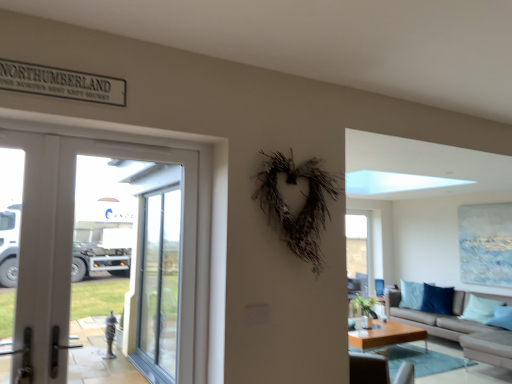
Question: Considering the relative sizes of clear glass screen door at center, which appears as the 2th screen door when viewed from the front, and light brown wooden coffee table at lower center in the image provided, is clear glass screen door at center, which appears as the 2th screen door when viewed from the front, wider than light brown wooden coffee table at lower center?

Choices:
 (A) yes
 (B) no

Answer: (B)

Question: Is clear glass screen door at center, acting as the 1th screen door starting from the back, taller than light brown wooden coffee table at lower center?

Choices:
 (A) no
 (B) yes

Answer: (B)

Question: Is clear glass screen door at center, acting as the 1th screen door starting from the back, aimed at light brown wooden coffee table at lower center?

Choices:
 (A) yes
 (B) no

Answer: (A)

Question: Are clear glass screen door at center, which appears as the 2th screen door when viewed from the front, and light brown wooden coffee table at lower center located far from each other?

Choices:
 (A) yes
 (B) no

Answer: (A)

Question: Is light brown wooden coffee table at lower center inside clear glass screen door at center, acting as the 1th screen door starting from the back?

Choices:
 (A) yes
 (B) no

Answer: (B)

Question: Can you see clear glass screen door at center, acting as the 1th screen door starting from the back, touching light brown wooden coffee table at lower center?

Choices:
 (A) yes
 (B) no

Answer: (B)

Question: Can you confirm if light brown wooden coffee table at lower center is smaller than beige fabric couch at lower right?

Choices:
 (A) yes
 (B) no

Answer: (A)

Question: From a real-world perspective, is light brown wooden coffee table at lower center on beige fabric couch at lower right?

Choices:
 (A) yes
 (B) no

Answer: (B)

Question: Is light brown wooden coffee table at lower center not within beige fabric couch at lower right?

Choices:
 (A) no
 (B) yes

Answer: (B)

Question: Can you confirm if light brown wooden coffee table at lower center is positioned to the right of beige fabric couch at lower right?

Choices:
 (A) no
 (B) yes

Answer: (A)

Question: Is light brown wooden coffee table at lower center shorter than beige fabric couch at lower right?

Choices:
 (A) yes
 (B) no

Answer: (A)

Question: Does light brown wooden coffee table at lower center have a greater height compared to beige fabric couch at lower right?

Choices:
 (A) yes
 (B) no

Answer: (B)

Question: Is light brown wooden coffee table at lower center positioned with its back to white glossy door at left?

Choices:
 (A) yes
 (B) no

Answer: (B)